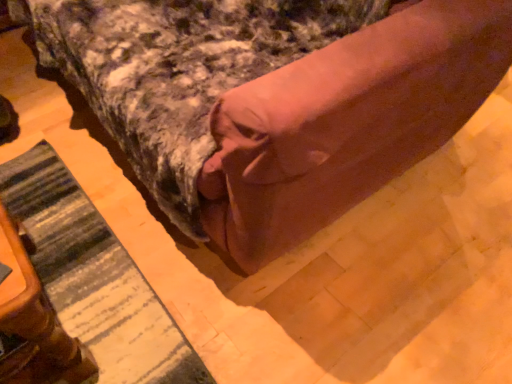
Question: In terms of width, does wooden table at lower left look wider or thinner when compared to brown fabric bed at center?

Choices:
 (A) thin
 (B) wide

Answer: (A)

Question: From a real-world perspective, is wooden table at lower left positioned above or below brown fabric bed at center?

Choices:
 (A) above
 (B) below

Answer: (B)

Question: Considering the real-world distances, which object is closest to the wooden table at lower left?

Choices:
 (A) striped fabric mat at lower left
 (B) brown fabric bed at center

Answer: (A)

Question: Estimate the real-world distances between objects in this image. Which object is closer to the wooden table at lower left?

Choices:
 (A) striped fabric mat at lower left
 (B) brown fabric bed at center

Answer: (A)